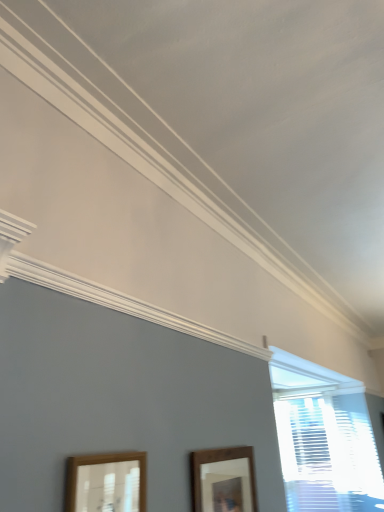
Describe the element at coordinates (106, 482) in the screenshot. The image size is (384, 512). I see `wooden picture frame at lower left, which is the 1th picture frame from left to right` at that location.

Locate an element on the screen. The image size is (384, 512). brown wooden picture frame at lower center, the 1th picture frame viewed from the right is located at coordinates (223, 480).

Locate an element on the screen. Image resolution: width=384 pixels, height=512 pixels. wooden picture frame at lower left, which is the 1th picture frame from left to right is located at coordinates (106, 482).

Can we say wooden picture frame at lower left, which is the 1th picture frame from left to right, lies outside brown wooden picture frame at lower center, the 1th picture frame viewed from the right?

That's correct, wooden picture frame at lower left, which is the 1th picture frame from left to right, is outside of brown wooden picture frame at lower center, the 1th picture frame viewed from the right.

Is wooden picture frame at lower left, which is the 1th picture frame from left to right, wider than brown wooden picture frame at lower center, which ranks as the first picture frame in back-to-front order?

Yes, wooden picture frame at lower left, which is the 1th picture frame from left to right, is wider than brown wooden picture frame at lower center, which ranks as the first picture frame in back-to-front order.

Is wooden picture frame at lower left, which is counted as the 1th picture frame, starting from the front, to the left of brown wooden picture frame at lower center, which ranks as the first picture frame in back-to-front order, from the viewer's perspective?

Yes, wooden picture frame at lower left, which is counted as the 1th picture frame, starting from the front, is to the left of brown wooden picture frame at lower center, which ranks as the first picture frame in back-to-front order.

Would you say white textured blinds at right is to the left or to the right of brown wooden picture frame at lower center, which is the 2th picture frame in front-to-back order, in the picture?

Clearly, white textured blinds at right is on the right of brown wooden picture frame at lower center, which is the 2th picture frame in front-to-back order, in the image.

Is white textured blinds at right facing away from brown wooden picture frame at lower center, which ranks as the first picture frame in back-to-front order?

white textured blinds at right does not have its back to brown wooden picture frame at lower center, which ranks as the first picture frame in back-to-front order.

Is white textured blinds at right wider than brown wooden picture frame at lower center, which is the 2th picture frame in front-to-back order?

Indeed, white textured blinds at right has a greater width compared to brown wooden picture frame at lower center, which is the 2th picture frame in front-to-back order.

Between white textured blinds at right and brown wooden picture frame at lower center, which is the 2th picture frame in front-to-back order, which one has larger size?

Bigger between the two is white textured blinds at right.

Is wooden picture frame at lower left, which is counted as the 1th picture frame, starting from the front, to the right of white textured blinds at right from the viewer's perspective?

Incorrect, wooden picture frame at lower left, which is counted as the 1th picture frame, starting from the front, is not on the right side of white textured blinds at right.

From the picture: Is wooden picture frame at lower left, which is the 1th picture frame from left to right, oriented towards white textured blinds at right?

No, wooden picture frame at lower left, which is the 1th picture frame from left to right, is not facing towards white textured blinds at right.

Considering the relative positions of wooden picture frame at lower left, which is the 1th picture frame from left to right, and white textured blinds at right in the image provided, is wooden picture frame at lower left, which is the 1th picture frame from left to right, behind white textured blinds at right?

That is False.

Looking at the image, does wooden picture frame at lower left, which is counted as the 1th picture frame, starting from the front, seem bigger or smaller compared to white textured blinds at right?

In the image, wooden picture frame at lower left, which is counted as the 1th picture frame, starting from the front, appears to be smaller than white textured blinds at right.

Is white textured blinds at right in contact with wooden picture frame at lower left, positioned as the 2th picture frame in right-to-left order?

No, white textured blinds at right is not in contact with wooden picture frame at lower left, positioned as the 2th picture frame in right-to-left order.

Considering their positions, is white textured blinds at right located in front of or behind wooden picture frame at lower left, the 2th picture frame in the back-to-front sequence?

Clearly, white textured blinds at right is behind wooden picture frame at lower left, the 2th picture frame in the back-to-front sequence.

Who is smaller, white textured blinds at right or wooden picture frame at lower left, which is counted as the 1th picture frame, starting from the front?

wooden picture frame at lower left, which is counted as the 1th picture frame, starting from the front, is smaller.

Measure the distance between white textured blinds at right and wooden picture frame at lower left, which is counted as the 1th picture frame, starting from the front.

white textured blinds at right and wooden picture frame at lower left, which is counted as the 1th picture frame, starting from the front, are 3.48 meters apart.

Is brown wooden picture frame at lower center, which ranks as the first picture frame in back-to-front order, wider or thinner than white textured blinds at right?

Clearly, brown wooden picture frame at lower center, which ranks as the first picture frame in back-to-front order, has less width compared to white textured blinds at right.

Considering the sizes of objects brown wooden picture frame at lower center, the 1th picture frame viewed from the right, and white textured blinds at right in the image provided, who is taller, brown wooden picture frame at lower center, the 1th picture frame viewed from the right, or white textured blinds at right?

Standing taller between the two is white textured blinds at right.

Which is closer to the camera, (222, 457) or (367, 412)?

Point (222, 457) is closer to the camera than point (367, 412).

Based on the photo, is brown wooden picture frame at lower center, the 2th picture frame when ordered from left to right, with white textured blinds at right?

brown wooden picture frame at lower center, the 2th picture frame when ordered from left to right, and white textured blinds at right are not in contact.

Is brown wooden picture frame at lower center, the 2th picture frame when ordered from left to right, in contact with wooden picture frame at lower left, which is the 1th picture frame from left to right?

No, brown wooden picture frame at lower center, the 2th picture frame when ordered from left to right, is not with wooden picture frame at lower left, which is the 1th picture frame from left to right.

Does point (221, 454) lie in front of point (70, 494)?

No, it is not.

Can you tell me how much brown wooden picture frame at lower center, the 1th picture frame viewed from the right, and wooden picture frame at lower left, the 2th picture frame in the back-to-front sequence, differ in facing direction?

0.349 degrees.

Identify the location of picture frame located above the wooden picture frame at lower left, which is the 1th picture frame from left to right (from a real-world perspective). The width and height of the screenshot is (384, 512). (223, 480).

Find the location of a particular element. The width and height of the screenshot is (384, 512). picture frame to the right of wooden picture frame at lower left, which is counted as the 1th picture frame, starting from the front is located at coordinates (223, 480).

Where is `picture frame that is the 1st one when counting leftward from the white textured blinds at right`? The image size is (384, 512). picture frame that is the 1st one when counting leftward from the white textured blinds at right is located at coordinates (223, 480).

Estimate the real-world distances between objects in this image. Which object is further from brown wooden picture frame at lower center, the 1th picture frame viewed from the right, white textured blinds at right or wooden picture frame at lower left, which is the 1th picture frame from left to right?

white textured blinds at right lies further to brown wooden picture frame at lower center, the 1th picture frame viewed from the right, than the other object.

Considering their positions, is wooden picture frame at lower left, which is the 1th picture frame from left to right, positioned closer to white textured blinds at right than brown wooden picture frame at lower center, which ranks as the first picture frame in back-to-front order?

brown wooden picture frame at lower center, which ranks as the first picture frame in back-to-front order, is positioned closer to the anchor white textured blinds at right.

Which object lies nearer to the anchor point wooden picture frame at lower left, the 2th picture frame in the back-to-front sequence, brown wooden picture frame at lower center, the 1th picture frame viewed from the right, or white textured blinds at right?

brown wooden picture frame at lower center, the 1th picture frame viewed from the right, lies closer to wooden picture frame at lower left, the 2th picture frame in the back-to-front sequence, than the other object.

Based on their spatial positions, is brown wooden picture frame at lower center, which is the 2th picture frame in front-to-back order, or wooden picture frame at lower left, the 2th picture frame in the back-to-front sequence, closer to white textured blinds at right?

The object closer to white textured blinds at right is brown wooden picture frame at lower center, which is the 2th picture frame in front-to-back order.

Looking at the image, which one is located closer to brown wooden picture frame at lower center, the 1th picture frame viewed from the right, wooden picture frame at lower left, the 2th picture frame in the back-to-front sequence, or white textured blinds at right?

wooden picture frame at lower left, the 2th picture frame in the back-to-front sequence, is closer to brown wooden picture frame at lower center, the 1th picture frame viewed from the right.

Considering their positions, is white textured blinds at right positioned further to wooden picture frame at lower left, which is the 1th picture frame from left to right, than brown wooden picture frame at lower center, which ranks as the first picture frame in back-to-front order?

Among the two, white textured blinds at right is located further to wooden picture frame at lower left, which is the 1th picture frame from left to right.

The image size is (384, 512). In order to click on picture frame positioned between wooden picture frame at lower left, the 2th picture frame in the back-to-front sequence, and white textured blinds at right from near to far in this screenshot , I will do `click(223, 480)`.